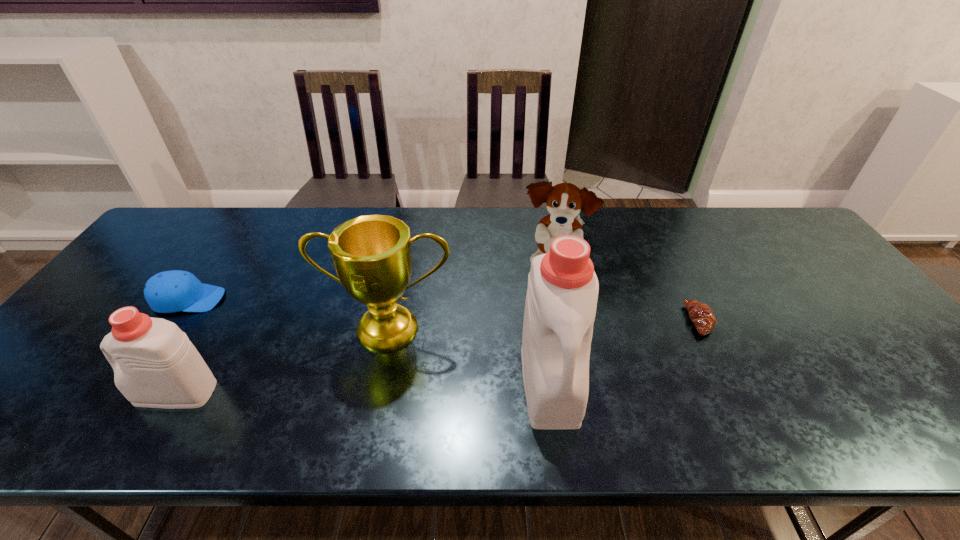
Locate an element on the screen. the shorter detergent is located at coordinates (155, 365).

Find the location of a particular element. the right detergent is located at coordinates (561, 301).

You are a GUI agent. You are given a task and a screenshot of the screen. Output one action in this format:
    pyautogui.click(x=<x>, y=<y>)
    Task: Click on the tallest object
    
    Given the screenshot: What is the action you would take?
    click(561, 301)

Locate an element on the screen. The height and width of the screenshot is (540, 960). the shortest object is located at coordinates (701, 314).

Find the location of a particular element. crescent roll is located at coordinates (701, 314).

The height and width of the screenshot is (540, 960). What are the coordinates of `award` in the screenshot? It's located at (371, 254).

Where is `cap`? This screenshot has width=960, height=540. cap is located at coordinates (172, 291).

The height and width of the screenshot is (540, 960). I want to click on puppy, so click(564, 201).

Locate an element on the screen. The image size is (960, 540). free region located 0.180m on the handle side of the left detergent is located at coordinates (58, 393).

This screenshot has width=960, height=540. Identify the location of free space located 0.250m on the handle side of the left detergent. (26, 393).